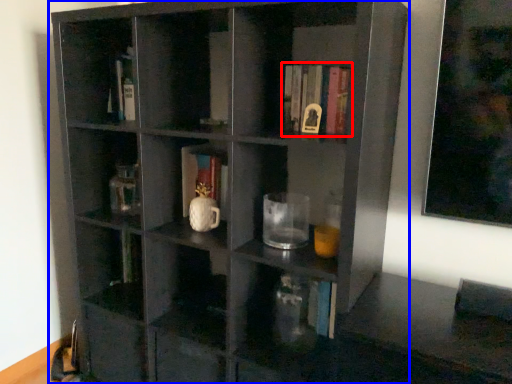
Question: Which object appears farthest to the camera in this image, book (highlighted by a red box) or shelf (highlighted by a blue box)?

Choices:
 (A) book
 (B) shelf

Answer: (A)